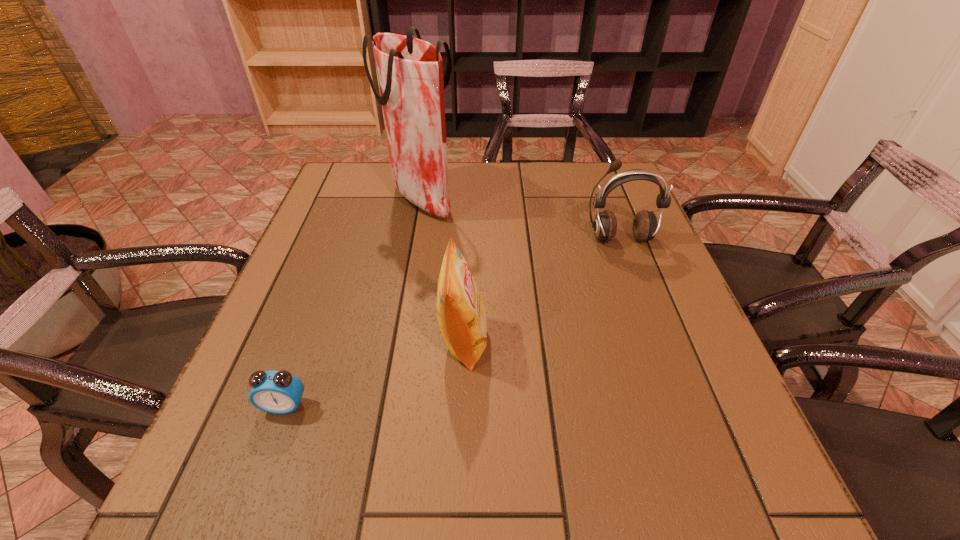
Find the location of `vacant space located 0.110m on the face of the leftmost object`. vacant space located 0.110m on the face of the leftmost object is located at coordinates [256, 483].

What are the coordinates of `object present at the far edge` in the screenshot? It's located at (410, 71).

You are a GUI agent. You are given a task and a screenshot of the screen. Output one action in this format:
    pyautogui.click(x=<x>, y=<y>)
    Task: Click on the object that is at the left edge
    
    Given the screenshot: What is the action you would take?
    pyautogui.click(x=279, y=392)

The height and width of the screenshot is (540, 960). I want to click on object that is at the right edge, so click(x=645, y=226).

What are the coordinates of `free region at the far edge of the desktop` in the screenshot? It's located at (551, 184).

The image size is (960, 540). Find the location of `vacant space at the near edge of the desktop`. vacant space at the near edge of the desktop is located at coordinates (541, 511).

Find the location of a particular element. This screenshot has height=540, width=960. free space at the left edge of the desktop is located at coordinates (289, 287).

In the image, there is a desktop. Where is `vacant space at the right edge`? Image resolution: width=960 pixels, height=540 pixels. vacant space at the right edge is located at coordinates pyautogui.click(x=665, y=306).

In the image, there is a desktop. Identify the location of vacant space at the far left corner. The height and width of the screenshot is (540, 960). (387, 176).

In the image, there is a desktop. Where is `free region at the far right corner`? The image size is (960, 540). free region at the far right corner is located at coordinates (601, 163).